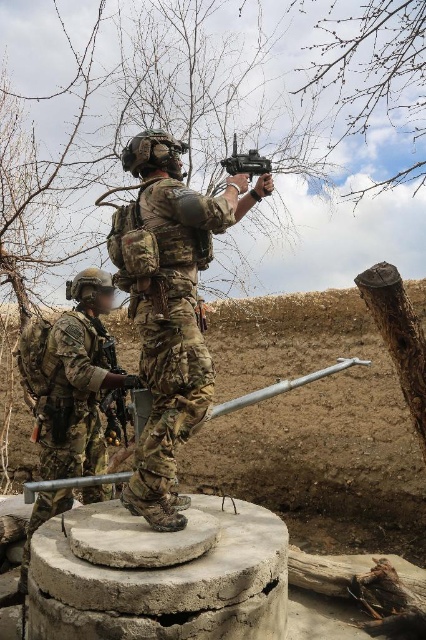
Question: Estimate the real-world distances between objects in this image. Which object is farther from the camouflage uniform at center?

Choices:
 (A) matte black rifle at upper center
 (B) camouflage fabric uniform at center

Answer: (A)

Question: Does camouflage uniform at center appear on the right side of matte black rifle at upper center?

Choices:
 (A) no
 (B) yes

Answer: (A)

Question: Which point is closer to the camera?

Choices:
 (A) camouflage fabric uniform at center
 (B) camouflage uniform at center

Answer: (A)

Question: Is camouflage fabric uniform at center thinner than matte black rifle at upper center?

Choices:
 (A) no
 (B) yes

Answer: (A)

Question: Which object appears farthest from the camera in this image?

Choices:
 (A) camouflage uniform at center
 (B) matte black rifle at upper center

Answer: (A)

Question: Is camouflage fabric uniform at center thinner than camouflage uniform at center?

Choices:
 (A) no
 (B) yes

Answer: (A)